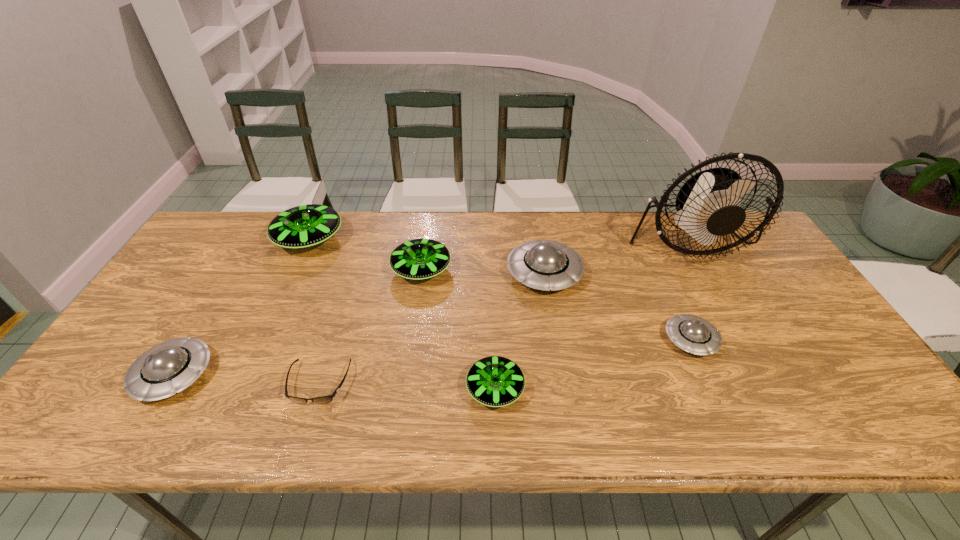
Identify the location of vacant space at the right edge of the desktop. This screenshot has width=960, height=540. (813, 338).

I want to click on vacant space at the far left corner of the desktop, so click(x=222, y=220).

Locate an element on the screen. This screenshot has width=960, height=540. vacant area at the near left corner is located at coordinates (131, 432).

In the image, there is a desktop. Where is `vacant space at the far right corner`? The height and width of the screenshot is (540, 960). vacant space at the far right corner is located at coordinates (735, 253).

This screenshot has height=540, width=960. Identify the location of vacant area between the second smallest green saucer and the second smallest gray saucer. (298, 322).

Identify the location of free spot between the leftmost green saucer and the fan. (498, 240).

You are a GUI agent. You are given a task and a screenshot of the screen. Output one action in this format:
    pyautogui.click(x=<x>, y=<y>)
    Task: Click on the free space that is in between the second green saucer from right to left and the rightmost saucer
    
    Given the screenshot: What is the action you would take?
    pyautogui.click(x=556, y=305)

Identify the location of vacant space that's between the second green saucer from right to left and the leftmost gray saucer. (298, 322).

You are a GUI agent. You are given a task and a screenshot of the screen. Output one action in this format:
    pyautogui.click(x=<x>, y=<y>)
    Task: Click on the empty location between the sunglasses and the leftmost green saucer
    
    Given the screenshot: What is the action you would take?
    pyautogui.click(x=314, y=312)

You are a GUI agent. You are given a task and a screenshot of the screen. Output one action in this format:
    pyautogui.click(x=<x>, y=<y>)
    Task: Click on the free space between the fifth object from right to left and the farthest gray saucer
    The height and width of the screenshot is (540, 960).
    Given the screenshot: What is the action you would take?
    pyautogui.click(x=483, y=272)